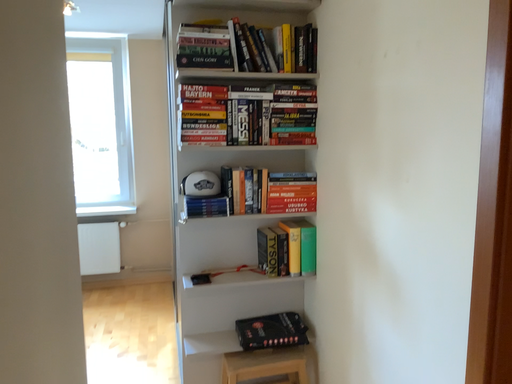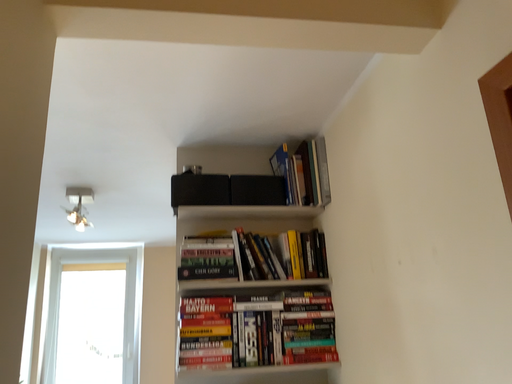
Question: Which way did the camera rotate in the video?

Choices:
 (A) rotated upward
 (B) rotated downward

Answer: (A)